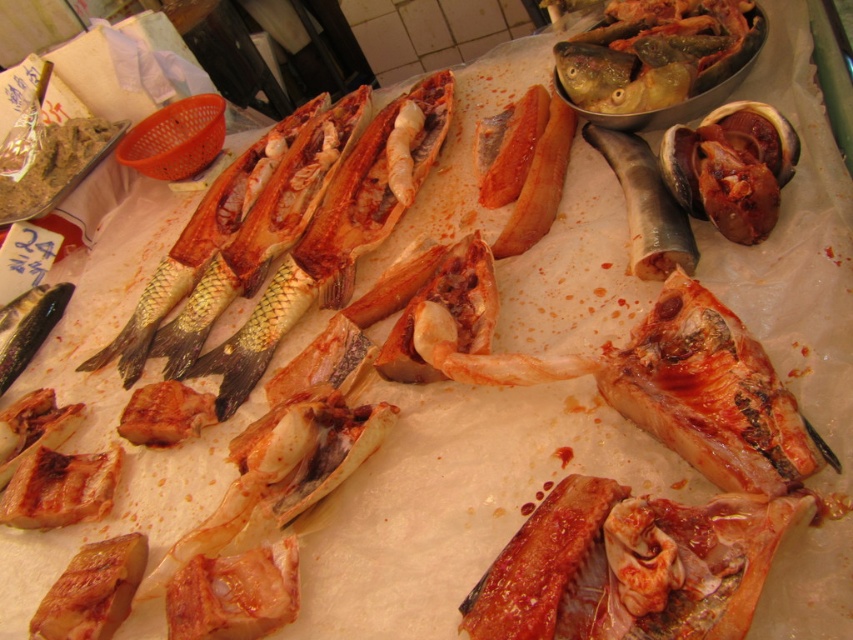
Which is more to the right, shiny silver fish at upper right or shiny silver fish at center?

Positioned to the right is shiny silver fish at upper right.

Is shiny silver fish at upper right to the right of shiny silver fish at center from the viewer's perspective?

Correct, you'll find shiny silver fish at upper right to the right of shiny silver fish at center.

Measure the distance between shiny silver fish at upper right and camera.

shiny silver fish at upper right and camera are 1.30 meters apart.

You are a GUI agent. You are given a task and a screenshot of the screen. Output one action in this format:
    pyautogui.click(x=<x>, y=<y>)
    Task: Click on the shiny silver fish at upper right
    The width and height of the screenshot is (853, 640).
    Given the screenshot: What is the action you would take?
    pyautogui.click(x=651, y=65)

Does dark purple glossy clam at upper right have a lesser width compared to shiny silver fish at center?

Yes, dark purple glossy clam at upper right is thinner than shiny silver fish at center.

Between point (761, 221) and point (206, 232), which one is positioned behind?

The point (206, 232) is more distant.

The image size is (853, 640). What are the coordinates of `dark purple glossy clam at upper right` in the screenshot? It's located at (730, 168).

The image size is (853, 640). I want to click on dark purple glossy clam at upper right, so click(x=730, y=168).

Who is higher up, shiny silver fish at upper right or shiny silver eel at center?

shiny silver fish at upper right is higher up.

Where is `shiny silver fish at upper right`? The image size is (853, 640). shiny silver fish at upper right is located at coordinates (651, 65).

Locate an element on the screen. The image size is (853, 640). shiny silver fish at upper right is located at coordinates (651, 65).